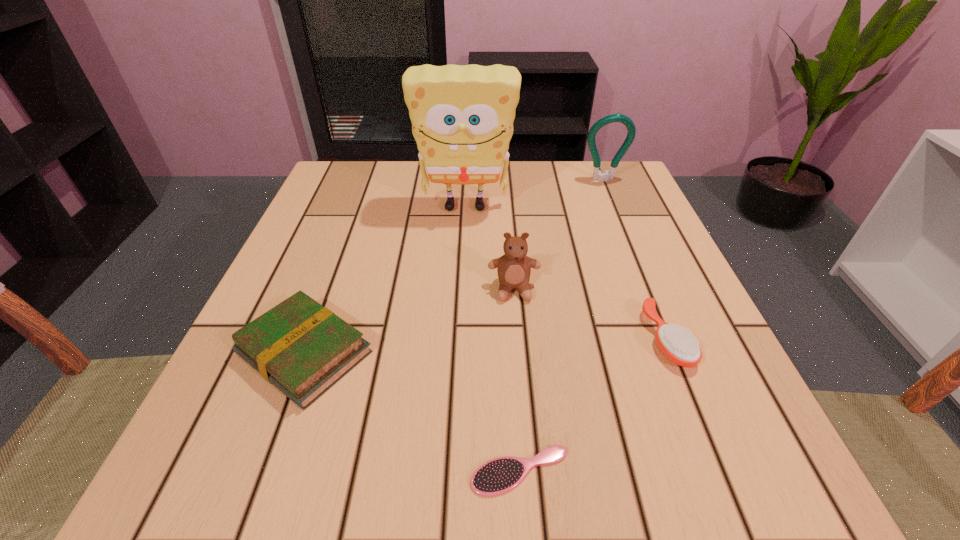
You are a GUI agent. You are given a task and a screenshot of the screen. Output one action in this format:
    pyautogui.click(x=<x>, y=<y>)
    Task: Click on the vacant space in between the leftmost object and the third tallest object
    The image size is (960, 540).
    Given the screenshot: What is the action you would take?
    pyautogui.click(x=409, y=321)

Locate an element on the screen. The image size is (960, 540). empty location between the nearer hairbrush and the teddy bear is located at coordinates (516, 380).

This screenshot has height=540, width=960. I want to click on empty space between the shortest object and the leftmost object, so click(413, 412).

This screenshot has width=960, height=540. Find the location of `vacant area that lies between the leftmost object and the teddy bear`. vacant area that lies between the leftmost object and the teddy bear is located at coordinates (409, 321).

This screenshot has height=540, width=960. Find the location of `free spot between the book and the second farthest object`. free spot between the book and the second farthest object is located at coordinates (385, 280).

Where is `free space between the third farthest object and the shorter hairbrush`? The image size is (960, 540). free space between the third farthest object and the shorter hairbrush is located at coordinates (516, 380).

Identify the location of unoccupied area between the sponge and the nearest object. The width and height of the screenshot is (960, 540). (492, 339).

You are a GUI agent. You are given a task and a screenshot of the screen. Output one action in this format:
    pyautogui.click(x=<x>, y=<y>)
    Task: Click on the vacant point located between the tallest object and the third farthest object
    
    Given the screenshot: What is the action you would take?
    pyautogui.click(x=490, y=247)

Identify the location of vacant region between the fourth shortest object and the farthest object. The height and width of the screenshot is (540, 960). (559, 234).

Identify the location of free spot between the second farthest object and the leftmost object. (385, 280).